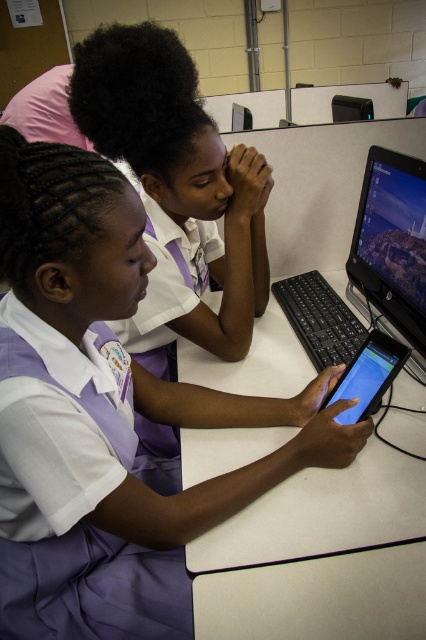
Question: From the image, what is the correct spatial relationship of white plastic table at center in relation to black glossy tablet at center?

Choices:
 (A) right
 (B) left

Answer: (B)

Question: Which point is closer to the camera?

Choices:
 (A) (132, 289)
 (B) (336, 547)
 (C) (362, 276)

Answer: (A)

Question: Can you confirm if white plastic table at center is thinner than black plastic monitor at center?

Choices:
 (A) yes
 (B) no

Answer: (B)

Question: Which of these objects is positioned farthest from the purple fabric uniform at center?

Choices:
 (A) black plastic monitor at center
 (B) black glossy tablet at center
 (C) white plastic table at center
 (D) purple fabric school uniform at lower left

Answer: (A)

Question: Considering the real-world distances, which object is closest to the black glossy tablet at center?

Choices:
 (A) purple fabric school uniform at lower left
 (B) purple fabric uniform at center
 (C) black plastic monitor at center
 (D) white plastic table at center

Answer: (D)

Question: Considering the relative positions of purple fabric uniform at center and white plastic table at center in the image provided, where is purple fabric uniform at center located with respect to white plastic table at center?

Choices:
 (A) left
 (B) right

Answer: (A)